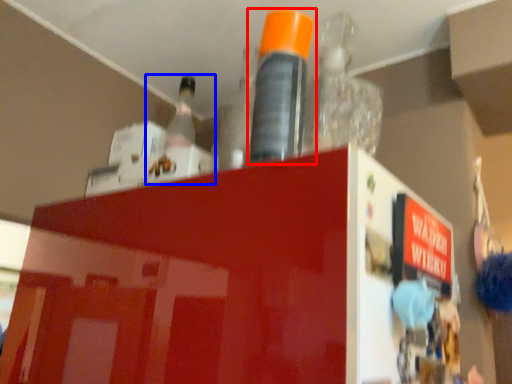
Question: Which of the following is the closest to the observer, bottle (highlighted by a red box) or bottle (highlighted by a blue box)?

Choices:
 (A) bottle
 (B) bottle

Answer: (A)